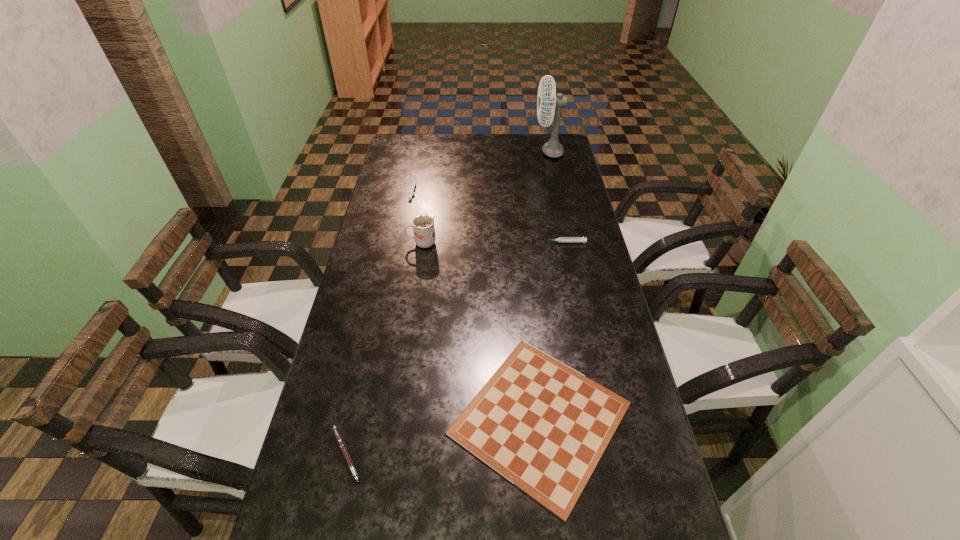
In order to click on fan in this screenshot , I will do `click(552, 148)`.

Find the location of a particular element. the tallest object is located at coordinates (552, 148).

Identify the location of the second tallest object. The width and height of the screenshot is (960, 540). (423, 225).

I want to click on the taller syringe, so click(561, 239).

The image size is (960, 540). Find the location of `the right syringe`. the right syringe is located at coordinates (561, 239).

The height and width of the screenshot is (540, 960). I want to click on the fifth nearest object, so point(411,192).

Locate an element on the screen. This screenshot has height=540, width=960. the farther syringe is located at coordinates click(x=411, y=192).

Find the location of a particular element. The width and height of the screenshot is (960, 540). the second shortest object is located at coordinates (337, 434).

This screenshot has width=960, height=540. Identify the location of the shortest object. (543, 426).

Locate an element on the screen. free region located 0.080m on the front-facing side of the farthest object is located at coordinates (516, 152).